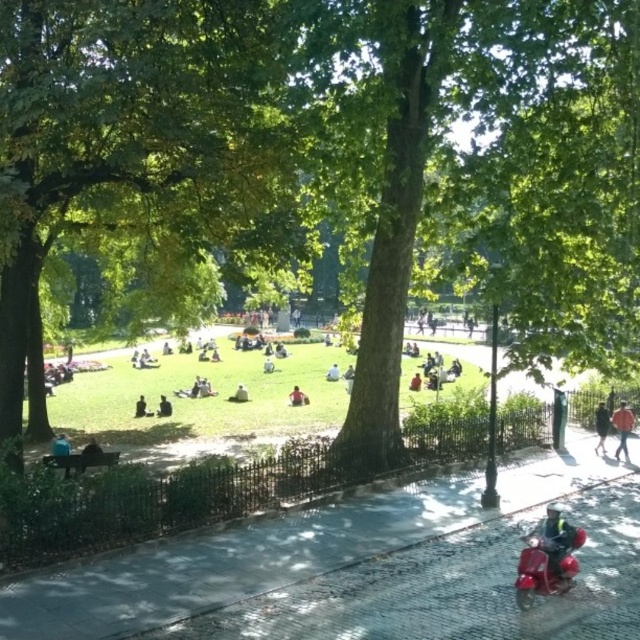
Is matte black jacket at center above dark brown leather jacket at center?

Yes.

Which of these two, matte black jacket at center or dark brown leather jacket at center, stands taller?

Standing taller between the two is dark brown leather jacket at center.

Where is `matte black jacket at center`? This screenshot has width=640, height=640. matte black jacket at center is located at coordinates (298, 397).

Who is more distant from viewer, [625,420] or [291,396]?

Positioned behind is point [291,396].

Based on the photo, does orange fabric jacket at lower right appear under matte black jacket at center?

Indeed, orange fabric jacket at lower right is positioned under matte black jacket at center.

Measure the distance between point (621,444) and camera.

They are 20.90 meters apart.

Where is `orange fabric jacket at lower right`? The image size is (640, 640). orange fabric jacket at lower right is located at coordinates (621, 428).

Where is `wooden park bench at center`? The image size is (640, 640). wooden park bench at center is located at coordinates (81, 460).

The height and width of the screenshot is (640, 640). What do you see at coordinates (81, 460) in the screenshot? I see `wooden park bench at center` at bounding box center [81, 460].

Image resolution: width=640 pixels, height=640 pixels. I want to click on wooden park bench at center, so click(81, 460).